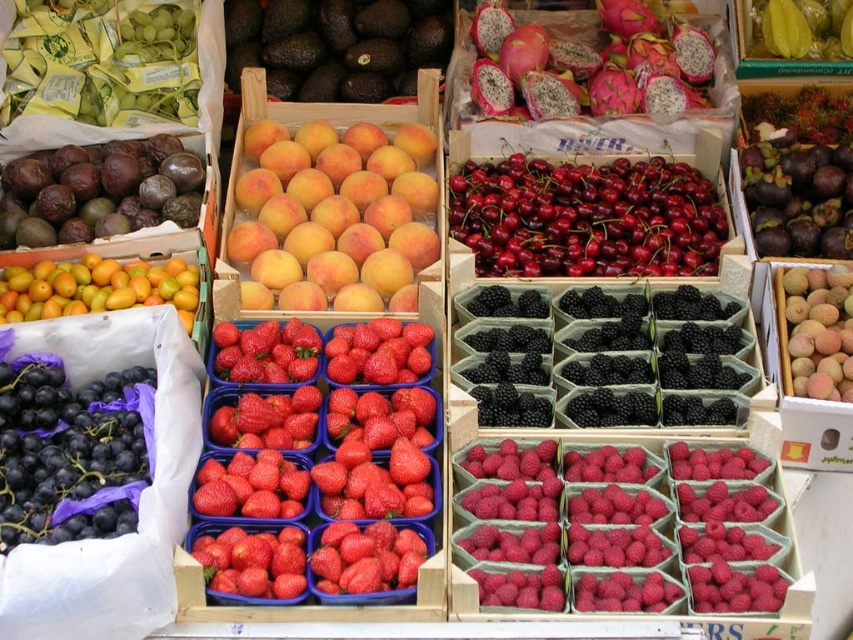
Question: Considering the real-world distances, which object is farthest from the shiny dark purple plums at left?

Choices:
 (A) shiny red cherries at center
 (B) pink spiky dragonfruit at upper right
 (C) green matte plum at left
 (D) yellow smooth carambola at center

Answer: (D)

Question: Which point is closer to the camera taking this photo?

Choices:
 (A) click(746, 160)
 (B) click(619, 157)
 (C) click(189, 124)

Answer: (A)

Question: In this image, where is shiny dark green avocado at center located relative to purple matte mangosteen at center-right?

Choices:
 (A) below
 (B) above

Answer: (B)

Question: Which object appears farthest from the camera in this image?

Choices:
 (A) green matte plum at left
 (B) shiny dark purple plums at left

Answer: (B)

Question: Can you confirm if pink spiky dragonfruit at upper right is wider than shiny dark purple plums at left?

Choices:
 (A) no
 (B) yes

Answer: (B)

Question: Does green matte grapes at upper left have a smaller size compared to shiny dark green avocado at center?

Choices:
 (A) no
 (B) yes

Answer: (B)